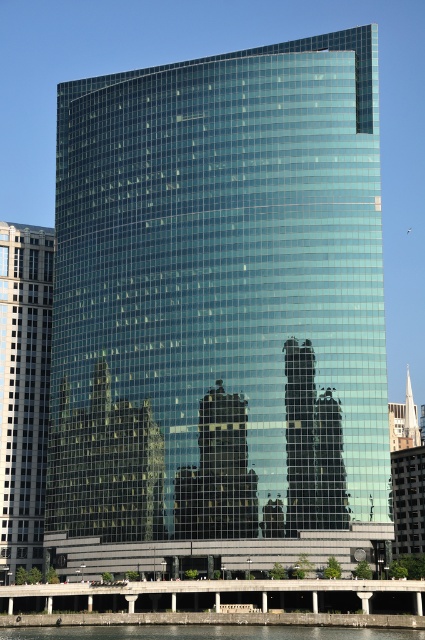
You are standing in front of the modern curved skyscraper with a glass facade. There is a point marked at coordinates (23, 392). Based on the description, can you determine what surface this point is located on?

The point at (23, 392) is located on the transparent glass skyscraper at center.

You are standing at the base of the curved skyscraper and looking up at its glass facade. You notice two points marked on the building. The first point is at coordinates point (357, 204) and the second is at point (122, 632). Which point is closer to the top of the building?

Point (357, 204) is behind point (122, 632), so it is closer to the top of the building.

You are an architect designing a new building and want to ensure it doesn not block the view of the transparent glass skyscraper at center and the clear glass water at lower center. Which object should you avoid placing closer to the front of your building?

The transparent glass skyscraper at center is thinner than clear glass water at lower center, so you should avoid placing objects closer to the front of your building that would block the view of the clear glass water at lower center, as it is wider and more prominent.